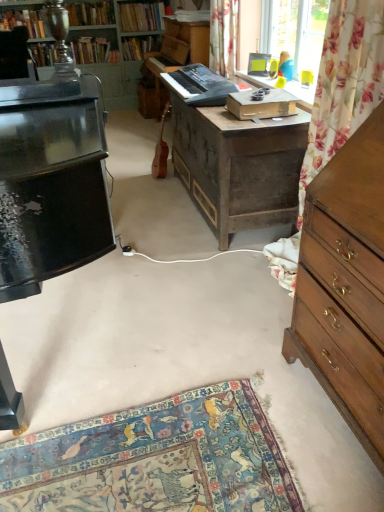
Question: Does black plastic keyboard at center, which is the 2th piano in front-to-back order, have a lesser height compared to hardcover book at upper left, which appears as the 3th book when viewed from the right?

Choices:
 (A) yes
 (B) no

Answer: (A)

Question: Is black plastic keyboard at center, acting as the second piano starting from the back, taller than hardcover book at upper left, which appears as the 3th book when viewed from the right?

Choices:
 (A) yes
 (B) no

Answer: (B)

Question: Is black plastic keyboard at center, acting as the second piano starting from the back, positioned far away from hardcover book at upper left, which appears as the 3th book when viewed from the right?

Choices:
 (A) yes
 (B) no

Answer: (A)

Question: From a real-world perspective, is black plastic keyboard at center, acting as the second piano starting from the back, below hardcover book at upper left, which appears as the 3th book when viewed from the right?

Choices:
 (A) yes
 (B) no

Answer: (B)

Question: Is black plastic keyboard at center, acting as the second piano starting from the back, positioned with its back to hardcover book at upper left, which is the third book in left-to-right order?

Choices:
 (A) no
 (B) yes

Answer: (A)

Question: Considering the relative sizes of black plastic keyboard at center, which is the 2th piano in front-to-back order, and hardcover book at upper left, which is the third book in left-to-right order, in the image provided, is black plastic keyboard at center, which is the 2th piano in front-to-back order, thinner than hardcover book at upper left, which is the third book in left-to-right order,?

Choices:
 (A) yes
 (B) no

Answer: (A)

Question: Is black plastic keyboard at center, acting as the second piano starting from the back, surrounding wooden desk at center?

Choices:
 (A) yes
 (B) no

Answer: (B)

Question: Is black plastic keyboard at center, which is the 2th piano in front-to-back order, turned away from wooden desk at center?

Choices:
 (A) yes
 (B) no

Answer: (B)

Question: From a real-world perspective, is black plastic keyboard at center, acting as the second piano starting from the back, beneath wooden desk at center?

Choices:
 (A) yes
 (B) no

Answer: (B)

Question: Considering the relative positions of black plastic keyboard at center, which is the 2th piano in front-to-back order, and wooden desk at center in the image provided, is black plastic keyboard at center, which is the 2th piano in front-to-back order, to the right of wooden desk at center from the viewer's perspective?

Choices:
 (A) no
 (B) yes

Answer: (A)

Question: Considering the relative sizes of black plastic keyboard at center, acting as the second piano starting from the back, and wooden desk at center in the image provided, is black plastic keyboard at center, acting as the second piano starting from the back, wider than wooden desk at center?

Choices:
 (A) no
 (B) yes

Answer: (A)

Question: Considering the relative positions of black plastic keyboard at center, acting as the second piano starting from the back, and wooden desk at center in the image provided, is black plastic keyboard at center, acting as the second piano starting from the back, behind wooden desk at center?

Choices:
 (A) no
 (B) yes

Answer: (B)

Question: Does floral fabric curtain at upper center have a greater width compared to hardcover book at upper center, the first book positioned from the right?

Choices:
 (A) no
 (B) yes

Answer: (A)